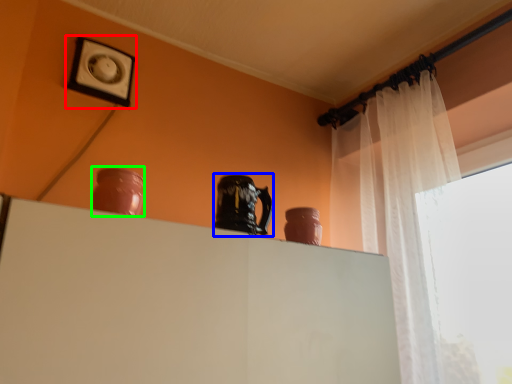
Question: Which is farther away from picture frame (highlighted by a red box)? pottery (highlighted by a blue box) or vase (highlighted by a green box)?

Choices:
 (A) pottery
 (B) vase

Answer: (A)